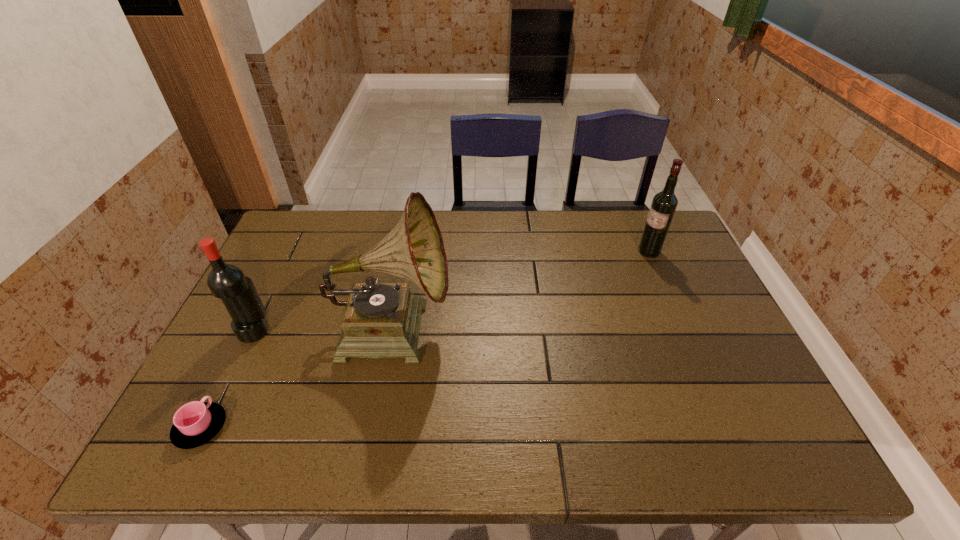
Where is `object situated at the near left corner`? object situated at the near left corner is located at coordinates (195, 423).

The image size is (960, 540). I want to click on object located at the far right corner, so click(664, 203).

Find the location of `free spot at the far edge of the desktop`. free spot at the far edge of the desktop is located at coordinates (390, 231).

At what (x,y) coordinates should I click in order to perform the action: click on vacant position at the near edge of the desktop. Please return your answer as a coordinate pair (x, y). This screenshot has height=540, width=960. Looking at the image, I should click on (496, 462).

At what (x,y) coordinates should I click in order to perform the action: click on vacant region at the left edge of the desktop. Please return your answer as a coordinate pair (x, y). Looking at the image, I should click on (227, 403).

The height and width of the screenshot is (540, 960). I want to click on empty location between the nearer wine bottle and the cup, so click(x=228, y=379).

Find the location of a particular element. The height and width of the screenshot is (540, 960). vacant space in between the tallest object and the rightmost object is located at coordinates (520, 289).

The image size is (960, 540). I want to click on empty space between the nearer wine bottle and the record player, so click(324, 328).

Where is `empty space between the cup and the nearer wine bottle`? Image resolution: width=960 pixels, height=540 pixels. empty space between the cup and the nearer wine bottle is located at coordinates click(228, 379).

The image size is (960, 540). I want to click on free space between the cup and the tallest object, so click(297, 377).